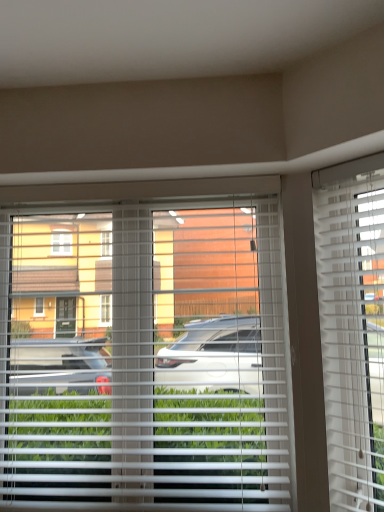
Image resolution: width=384 pixels, height=512 pixels. What do you see at coordinates (144, 357) in the screenshot?
I see `white plastic blinds at center, which appears as the 2th window blind when viewed from the right` at bounding box center [144, 357].

Identify the location of white plastic blinds at center, which appears as the 2th window blind when viewed from the right. The width and height of the screenshot is (384, 512). (144, 357).

Find the location of a particular element. The height and width of the screenshot is (512, 384). white plastic blinds at right, placed as the 1th window blind when sorted from right to left is located at coordinates (352, 327).

This screenshot has width=384, height=512. Describe the element at coordinates (352, 327) in the screenshot. I see `white plastic blinds at right, placed as the 1th window blind when sorted from right to left` at that location.

You are a GUI agent. You are given a task and a screenshot of the screen. Output one action in this format:
    pyautogui.click(x=<x>, y=<y>)
    Task: Click on the white plastic blinds at center, which appears as the 2th window blind when viewed from the right
    
    Given the screenshot: What is the action you would take?
    pyautogui.click(x=144, y=357)

From the picture: Which is more to the right, white plastic blinds at right, the second window blind in the left-to-right sequence, or white plastic blinds at center, which appears as the 2th window blind when viewed from the right?

From the viewer's perspective, white plastic blinds at right, the second window blind in the left-to-right sequence, appears more on the right side.

Is white plastic blinds at right, placed as the 1th window blind when sorted from right to left, positioned in front of white plastic blinds at center, which appears as the 2th window blind when viewed from the right?

Yes, it is in front of white plastic blinds at center, which appears as the 2th window blind when viewed from the right.

Is point (378, 354) positioned behind point (19, 234)?

That is False.

From the image's perspective, between white plastic blinds at right, the second window blind in the left-to-right sequence, and white plastic blinds at center, which appears as the 2th window blind when viewed from the right, which one is located above?

white plastic blinds at right, the second window blind in the left-to-right sequence.

From a real-world perspective, between white plastic blinds at right, the second window blind in the left-to-right sequence, and white plastic blinds at center, which appears as the 2th window blind when viewed from the right, who is vertically lower?

white plastic blinds at center, which appears as the 2th window blind when viewed from the right, is physically lower.

Considering the sizes of white plastic blinds at right, the second window blind in the left-to-right sequence, and white plastic blinds at center, which is the 1th window blind in left-to-right order, in the image, is white plastic blinds at right, the second window blind in the left-to-right sequence, wider or thinner than white plastic blinds at center, which is the 1th window blind in left-to-right order,?

Considering their sizes, white plastic blinds at right, the second window blind in the left-to-right sequence, looks slimmer than white plastic blinds at center, which is the 1th window blind in left-to-right order.

Can you confirm if white plastic blinds at right, placed as the 1th window blind when sorted from right to left, is taller than white plastic blinds at center, which appears as the 2th window blind when viewed from the right?

In fact, white plastic blinds at right, placed as the 1th window blind when sorted from right to left, may be shorter than white plastic blinds at center, which appears as the 2th window blind when viewed from the right.

Looking at the image, does white plastic blinds at right, placed as the 1th window blind when sorted from right to left, seem bigger or smaller compared to white plastic blinds at center, which appears as the 2th window blind when viewed from the right?

white plastic blinds at right, placed as the 1th window blind when sorted from right to left, is smaller than white plastic blinds at center, which appears as the 2th window blind when viewed from the right.

Would you say white plastic blinds at right, placed as the 1th window blind when sorted from right to left, contains white plastic blinds at center, which appears as the 2th window blind when viewed from the right?

No, white plastic blinds at center, which appears as the 2th window blind when viewed from the right, is not a part of white plastic blinds at right, placed as the 1th window blind when sorted from right to left.

Is white plastic blinds at right, placed as the 1th window blind when sorted from right to left, in contact with white plastic blinds at center, which appears as the 2th window blind when viewed from the right?

No, white plastic blinds at right, placed as the 1th window blind when sorted from right to left, is not with white plastic blinds at center, which appears as the 2th window blind when viewed from the right.

Is white plastic blinds at right, the second window blind in the left-to-right sequence, turned away from white plastic blinds at center, which is the 1th window blind in left-to-right order?

No.

Can you tell me how much white plastic blinds at right, the second window blind in the left-to-right sequence, and white plastic blinds at center, which is the 1th window blind in left-to-right order, differ in facing direction?

The angle between the facing direction of white plastic blinds at right, the second window blind in the left-to-right sequence, and the facing direction of white plastic blinds at center, which is the 1th window blind in left-to-right order, is 41.9 degrees.

Measure the distance between white plastic blinds at right, placed as the 1th window blind when sorted from right to left, and white plastic blinds at center, which is the 1th window blind in left-to-right order.

white plastic blinds at right, placed as the 1th window blind when sorted from right to left, and white plastic blinds at center, which is the 1th window blind in left-to-right order, are 55.81 centimeters apart from each other.

Where is `window blind behind the white plastic blinds at right, placed as the 1th window blind when sorted from right to left`? window blind behind the white plastic blinds at right, placed as the 1th window blind when sorted from right to left is located at coordinates (144, 357).

Would you say white plastic blinds at center, which is the 1th window blind in left-to-right order, is to the left or to the right of white plastic blinds at right, the second window blind in the left-to-right sequence, in the picture?

Based on their positions, white plastic blinds at center, which is the 1th window blind in left-to-right order, is located to the left of white plastic blinds at right, the second window blind in the left-to-right sequence.

Considering the positions of objects white plastic blinds at center, which is the 1th window blind in left-to-right order, and white plastic blinds at right, the second window blind in the left-to-right sequence, in the image provided, who is in front, white plastic blinds at center, which is the 1th window blind in left-to-right order, or white plastic blinds at right, the second window blind in the left-to-right sequence,?

white plastic blinds at right, the second window blind in the left-to-right sequence, is closer to the camera.

Is point (261, 440) more distant than point (330, 496)?

Yes.

From the image's perspective, which is above, white plastic blinds at center, which appears as the 2th window blind when viewed from the right, or white plastic blinds at right, the second window blind in the left-to-right sequence?

white plastic blinds at right, the second window blind in the left-to-right sequence.

From a real-world perspective, is white plastic blinds at center, which appears as the 2th window blind when viewed from the right, positioned above or below white plastic blinds at right, the second window blind in the left-to-right sequence?

In terms of real-world spatial position, white plastic blinds at center, which appears as the 2th window blind when viewed from the right, is below white plastic blinds at right, the second window blind in the left-to-right sequence.

Considering the relative sizes of white plastic blinds at center, which appears as the 2th window blind when viewed from the right, and white plastic blinds at right, the second window blind in the left-to-right sequence, in the image provided, is white plastic blinds at center, which appears as the 2th window blind when viewed from the right, wider than white plastic blinds at right, the second window blind in the left-to-right sequence,?

Correct, the width of white plastic blinds at center, which appears as the 2th window blind when viewed from the right, exceeds that of white plastic blinds at right, the second window blind in the left-to-right sequence.

Between white plastic blinds at center, which appears as the 2th window blind when viewed from the right, and white plastic blinds at right, the second window blind in the left-to-right sequence, which one has more height?

white plastic blinds at center, which appears as the 2th window blind when viewed from the right, is taller.

Does white plastic blinds at center, which is the 1th window blind in left-to-right order, have a smaller size compared to white plastic blinds at right, the second window blind in the left-to-right sequence?

No.

Can we say white plastic blinds at center, which appears as the 2th window blind when viewed from the right, lies outside white plastic blinds at right, the second window blind in the left-to-right sequence?

white plastic blinds at center, which appears as the 2th window blind when viewed from the right, lies outside white plastic blinds at right, the second window blind in the left-to-right sequence,'s area.

Is white plastic blinds at center, which is the 1th window blind in left-to-right order, positioned far away from white plastic blinds at right, placed as the 1th window blind when sorted from right to left?

That's not correct — white plastic blinds at center, which is the 1th window blind in left-to-right order, is a little close to white plastic blinds at right, placed as the 1th window blind when sorted from right to left.

Is white plastic blinds at center, which is the 1th window blind in left-to-right order, facing away from white plastic blinds at right, the second window blind in the left-to-right sequence?

No, white plastic blinds at center, which is the 1th window blind in left-to-right order, is not facing the opposite direction of white plastic blinds at right, the second window blind in the left-to-right sequence.

Measure the distance from white plastic blinds at center, which appears as the 2th window blind when viewed from the right, to white plastic blinds at right, placed as the 1th window blind when sorted from right to left.

A distance of 21.97 inches exists between white plastic blinds at center, which appears as the 2th window blind when viewed from the right, and white plastic blinds at right, placed as the 1th window blind when sorted from right to left.

Find the location of `window blind lying on the left of white plastic blinds at right, placed as the 1th window blind when sorted from right to left`. window blind lying on the left of white plastic blinds at right, placed as the 1th window blind when sorted from right to left is located at coordinates (144, 357).

Find the location of a particular element. Image resolution: width=384 pixels, height=512 pixels. window blind above the white plastic blinds at center, which appears as the 2th window blind when viewed from the right (from the image's perspective) is located at coordinates (352, 327).

Where is `window blind on the right of white plastic blinds at center, which is the 1th window blind in left-to-right order`? window blind on the right of white plastic blinds at center, which is the 1th window blind in left-to-right order is located at coordinates click(x=352, y=327).